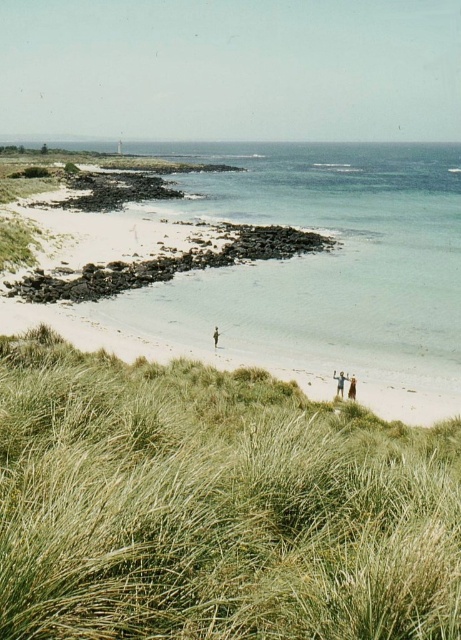
You are standing at the edge of the beach and see both the light brown wooden stick at lower right and the light brown hair at lower right. Which object is closer to your left side when facing the ocean?

The light brown wooden stick at lower right is positioned on the left side of light brown hair at lower right, so it is closer to your left side when facing the ocean.

You are standing on the beach looking at the scene. You notice the brown textured fabric at lower center and the light brown hair at lower right. Which object takes up more space in the image?

The brown textured fabric at lower center is larger in size than the light brown hair at lower right, so it takes up more space in the image.